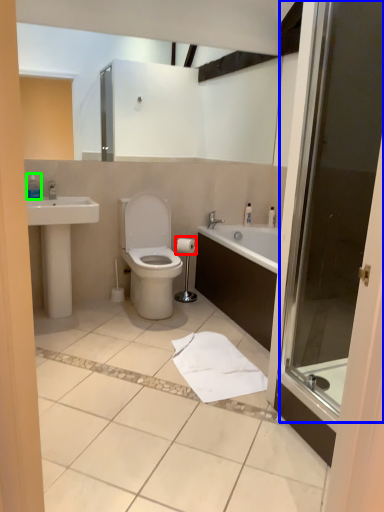
Question: Which object is the farthest from toilet paper (highlighted by a red box)? Choose among these: screen door (highlighted by a blue box) or toiletry (highlighted by a green box).

Choices:
 (A) screen door
 (B) toiletry

Answer: (A)